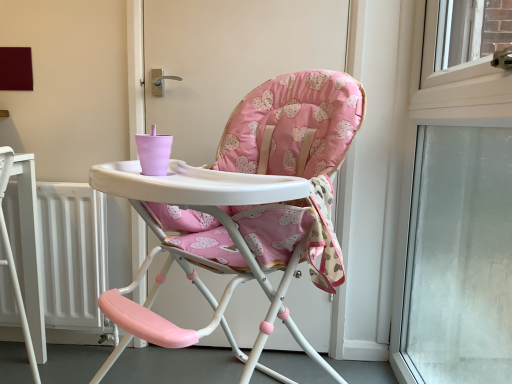
Measure the distance between point (x=83, y=272) and camera.

The depth of point (x=83, y=272) is 1.50 meters.

What do you see at coordinates (454, 217) in the screenshot?
I see `transparent glass window at right` at bounding box center [454, 217].

The image size is (512, 384). Describe the element at coordinates (245, 209) in the screenshot. I see `pink fabric highchair at center` at that location.

Where is `white matte radiator at lower left`? The height and width of the screenshot is (384, 512). white matte radiator at lower left is located at coordinates (78, 254).

Which object is positioned more to the right, transparent glass window at right or pink fabric highchair at center?

transparent glass window at right is more to the right.

Is transparent glass window at right looking in the opposite direction of pink fabric highchair at center?

No, pink fabric highchair at center is not at the back of transparent glass window at right.

Considering the sizes of objects transparent glass window at right and pink fabric highchair at center in the image provided, who is shorter, transparent glass window at right or pink fabric highchair at center?

transparent glass window at right is shorter.

From the picture: How far apart are transparent glass window at right and pink fabric highchair at center?

22.95 inches.

Is transparent glass window at right positioned in front of white matte radiator at lower left?

That is True.

How different are the orientations of transparent glass window at right and white matte radiator at lower left in degrees?

transparent glass window at right and white matte radiator at lower left are facing 89.9 degrees away from each other.

In terms of width, does transparent glass window at right look wider or thinner when compared to white matte radiator at lower left?

In the image, transparent glass window at right appears to be wider than white matte radiator at lower left.

Consider the image. Would you say pink fabric highchair at center is inside or outside transparent glass window at right?

pink fabric highchair at center is spatially situated outside transparent glass window at right.

Is there a large distance between pink fabric highchair at center and transparent glass window at right?

Actually, pink fabric highchair at center and transparent glass window at right are a little close together.

Does pink fabric highchair at center have a greater width compared to transparent glass window at right?

In fact, pink fabric highchair at center might be narrower than transparent glass window at right.

From a real-world perspective, is pink fabric highchair at center positioned under transparent glass window at right based on gravity?

No, from a real-world perspective, pink fabric highchair at center is not below transparent glass window at right.

Which is behind, point (67, 280) or point (497, 288)?

The point (497, 288) is farther from the camera.

Does white matte radiator at lower left contain transparent glass window at right?

No, white matte radiator at lower left does not contain transparent glass window at right.

Locate an element on the screen. window in front of the white matte radiator at lower left is located at coordinates (454, 217).

From the picture: From a real-world perspective, which object stands above the other?

From a 3D spatial view, transparent glass window at right is above.

Which object is closer to the camera taking this photo, pink fabric highchair at center or white matte radiator at lower left?

Positioned in front is pink fabric highchair at center.

Between pink fabric highchair at center and white matte radiator at lower left, which one has less height?

white matte radiator at lower left is shorter.

Does pink fabric highchair at center appear on the left side of white matte radiator at lower left?

No, pink fabric highchair at center is not to the left of white matte radiator at lower left.

Between pink fabric highchair at center and white matte radiator at lower left, which one has smaller width?

With smaller width is pink fabric highchair at center.

Is point (45, 283) closer or farther from the camera than point (321, 204)?

Clearly, point (45, 283) is more distant from the camera than point (321, 204).

Is pink fabric highchair at center at the back of white matte radiator at lower left?

No, white matte radiator at lower left is not facing away from pink fabric highchair at center.

Identify the location of window in front of the pink fabric highchair at center. This screenshot has width=512, height=384. (454, 217).

In the image, there is a transparent glass window at right. At what (x,y) coordinates should I click in order to perform the action: click on radiator below it (from the image's perspective). Please return your answer as a coordinate pair (x, y). The height and width of the screenshot is (384, 512). Looking at the image, I should click on (78, 254).

Considering their positions, is pink fabric highchair at center positioned closer to white matte radiator at lower left than transparent glass window at right?

pink fabric highchair at center is closer to white matte radiator at lower left.

Looking at the image, which one is located further to transparent glass window at right, white matte radiator at lower left or pink fabric highchair at center?

Based on the image, white matte radiator at lower left appears to be further to transparent glass window at right.

Estimate the real-world distances between objects in this image. Which object is further from pink fabric highchair at center, transparent glass window at right or white matte radiator at lower left?

The object further to pink fabric highchair at center is white matte radiator at lower left.

Based on their spatial positions, is transparent glass window at right or pink fabric highchair at center further from white matte radiator at lower left?

transparent glass window at right lies further to white matte radiator at lower left than the other object.

Looking at the image, which one is located further to transparent glass window at right, pink fabric highchair at center or white matte radiator at lower left?

The object further to transparent glass window at right is white matte radiator at lower left.

From the image, which object appears to be farther from pink fabric highchair at center, white matte radiator at lower left or transparent glass window at right?

white matte radiator at lower left.

I want to click on chair situated between white matte radiator at lower left and transparent glass window at right from left to right, so click(245, 209).